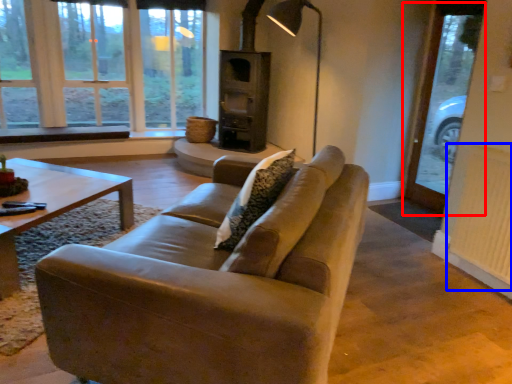
Question: Which point is further to the camera, screen door (highlighted by a red box) or radiator (highlighted by a blue box)?

Choices:
 (A) screen door
 (B) radiator

Answer: (A)